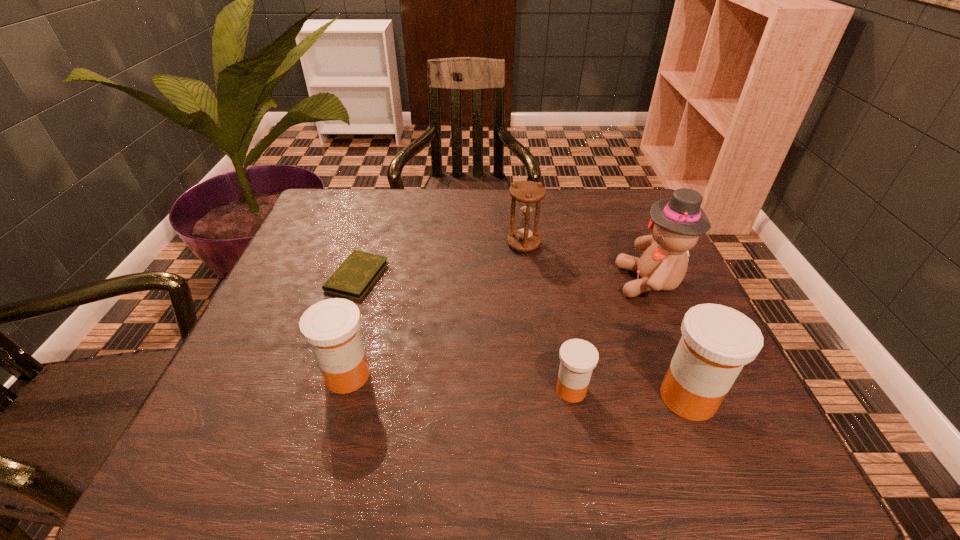
Where is `the second tallest medicine`? Image resolution: width=960 pixels, height=540 pixels. the second tallest medicine is located at coordinates (331, 326).

Where is `the shortest medicine`? the shortest medicine is located at coordinates (578, 358).

Locate an element on the screen. The image size is (960, 540). the second shortest object is located at coordinates (578, 358).

Locate an element on the screen. the rightmost medicine is located at coordinates (717, 341).

This screenshot has width=960, height=540. Identify the location of hourglass. (528, 194).

You are a GUI agent. You are given a task and a screenshot of the screen. Output one action in this format:
    pyautogui.click(x=<x>, y=<y>)
    Task: Click on the tallest object
    The width and height of the screenshot is (960, 540).
    Given the screenshot: What is the action you would take?
    pyautogui.click(x=676, y=223)

Find the location of `the shortest object`. the shortest object is located at coordinates (354, 277).

This screenshot has width=960, height=540. What are the coordinates of `vacant space located 0.280m on the label of the second medicine from right to left` in the screenshot? It's located at (396, 390).

You are a GUI agent. You are given a task and a screenshot of the screen. Output one action in this format:
    pyautogui.click(x=<x>, y=<y>)
    Task: Click on the free region located on the label of the second medicine from right to left
    This screenshot has width=960, height=540.
    Given the screenshot: What is the action you would take?
    pyautogui.click(x=346, y=390)

Locate an element on the screen. The width and height of the screenshot is (960, 540). vacant space situated on the label of the second medicine from right to left is located at coordinates (362, 390).